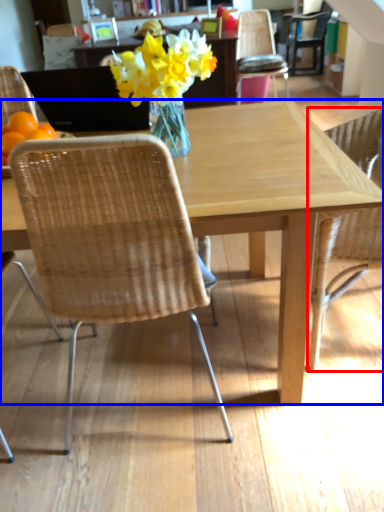
Question: Which object appears farthest to the camera in this image, chair (highlighted by a red box) or kitchen & dining room table (highlighted by a blue box)?

Choices:
 (A) chair
 (B) kitchen & dining room table

Answer: (A)